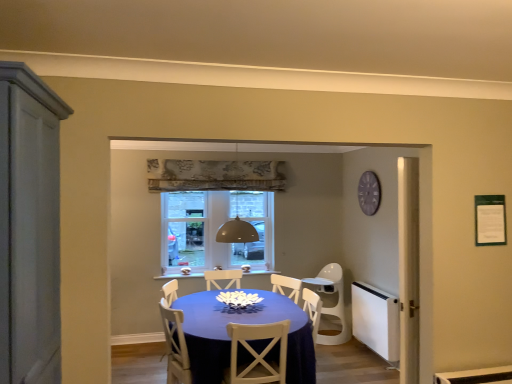
Question: Is purple wooden clock at upper right not near matte blue table at center?

Choices:
 (A) no
 (B) yes

Answer: (B)

Question: Is purple wooden clock at upper right completely or partially outside of matte blue table at center?

Choices:
 (A) no
 (B) yes

Answer: (B)

Question: Can you confirm if purple wooden clock at upper right is bigger than matte blue table at center?

Choices:
 (A) no
 (B) yes

Answer: (A)

Question: Considering the relative sizes of purple wooden clock at upper right and matte blue table at center in the image provided, is purple wooden clock at upper right smaller than matte blue table at center?

Choices:
 (A) yes
 (B) no

Answer: (A)

Question: From a real-world perspective, is purple wooden clock at upper right located beneath matte blue table at center?

Choices:
 (A) yes
 (B) no

Answer: (B)

Question: Considering the positions of point (330, 284) and point (273, 367), is point (330, 284) closer or farther from the camera than point (273, 367)?

Choices:
 (A) closer
 (B) farther

Answer: (B)

Question: Relative to white wood chair at center, positioned as the 1th chair in front-to-back order, is white plastic chair at center, positioned as the first chair in back-to-front order, in front or behind?

Choices:
 (A) behind
 (B) front

Answer: (A)

Question: Based on their positions, is white plastic chair at center, acting as the 1th chair starting from the right, located to the left or right of white wood chair at center, the 1th chair in the left-to-right sequence?

Choices:
 (A) left
 (B) right

Answer: (B)

Question: In terms of size, does white plastic chair at center, the second chair in the front-to-back sequence, appear bigger or smaller than white wood chair at center, positioned as the 1th chair in front-to-back order?

Choices:
 (A) big
 (B) small

Answer: (A)

Question: From the image's perspective, is white wood chair at center, the 1th chair in the left-to-right sequence, above or below purple wooden clock at upper right?

Choices:
 (A) below
 (B) above

Answer: (A)

Question: Would you say white wood chair at center, the 1th chair in the left-to-right sequence, is inside or outside purple wooden clock at upper right?

Choices:
 (A) inside
 (B) outside

Answer: (B)

Question: From a real-world perspective, is white wood chair at center, the 1th chair in the left-to-right sequence, above or below purple wooden clock at upper right?

Choices:
 (A) below
 (B) above

Answer: (A)

Question: Based on their sizes in the image, would you say white wood chair at center, the second chair from the right, is bigger or smaller than purple wooden clock at upper right?

Choices:
 (A) small
 (B) big

Answer: (B)

Question: From the image's perspective, is matte blue table at center located above or below clear glass window at center?

Choices:
 (A) below
 (B) above

Answer: (A)

Question: In the image, is matte blue table at center positioned in front of or behind clear glass window at center?

Choices:
 (A) behind
 (B) front

Answer: (B)